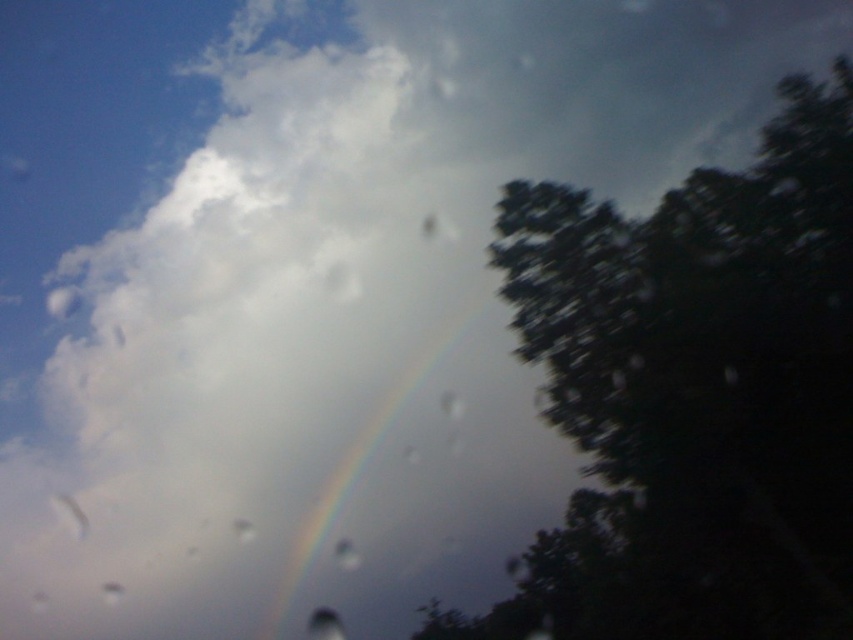
Is point (808, 264) positioned before point (283, 563)?

Yes.

You are a GUI agent. You are given a task and a screenshot of the screen. Output one action in this format:
    pyautogui.click(x=<x>, y=<y>)
    Task: Click on the dark green leafy tree at right
    This screenshot has height=640, width=853.
    Given the screenshot: What is the action you would take?
    pyautogui.click(x=693, y=394)